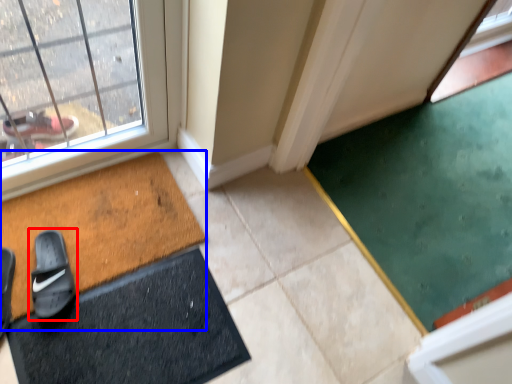
Question: Which object is closer to the camera taking this photo, footwear (highlighted by a red box) or bath mat (highlighted by a blue box)?

Choices:
 (A) footwear
 (B) bath mat

Answer: (B)